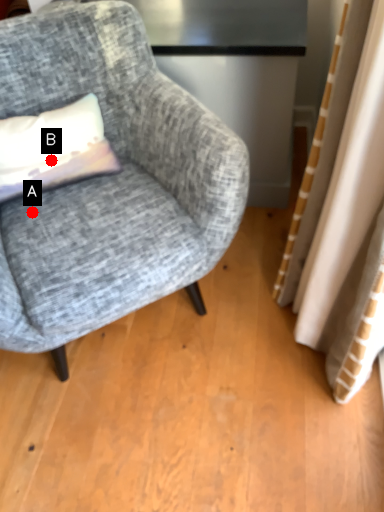
Question: Two points are circled on the image, labeled by A and B beside each circle. Which point is closer to the camera taking this photo?

Choices:
 (A) A is closer
 (B) B is closer

Answer: (A)